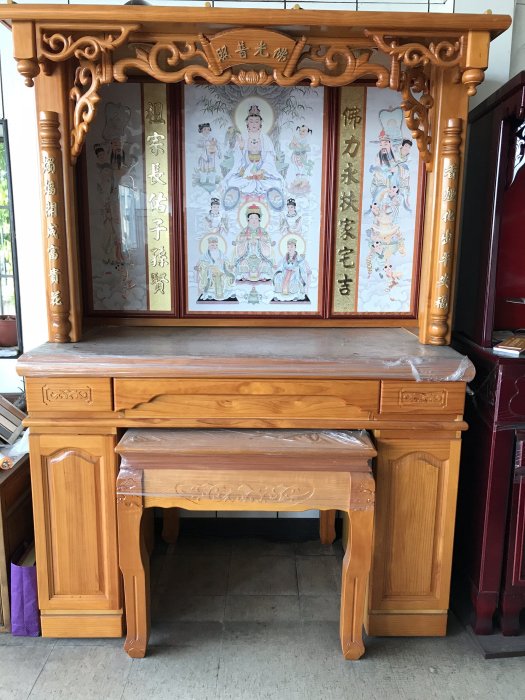
I want to click on leftmost glass panel, so click(123, 194).